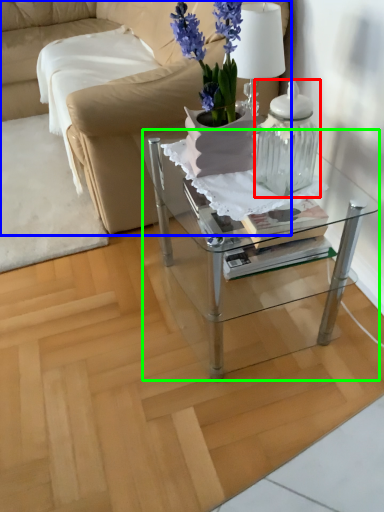
Question: Which object is the closest to the candle holder (highlighted by a red box)? Choose among these: studio couch (highlighted by a blue box) or table (highlighted by a green box).

Choices:
 (A) studio couch
 (B) table

Answer: (B)